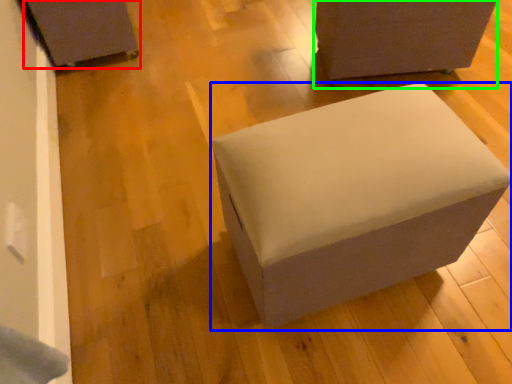
Question: Estimate the real-world distances between objects in this image. Which object is farther from furniture (highlighted by a red box), furniture (highlighted by a blue box) or furniture (highlighted by a green box)?

Choices:
 (A) furniture
 (B) furniture

Answer: (A)